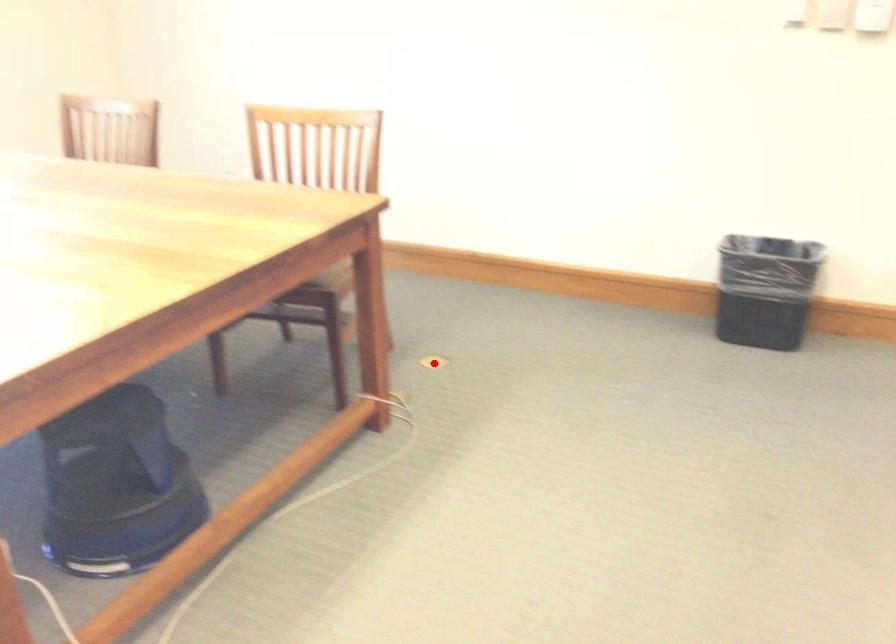
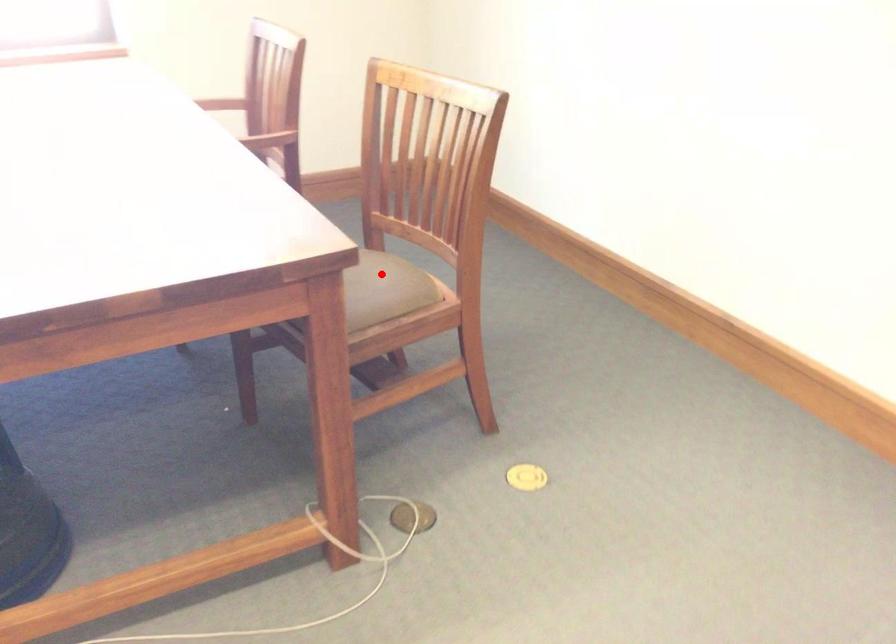
I am providing you with two images of the same scene from different viewpoints. A red point is marked on the first image and another point is marked on the second image. Do the highlighted points in image1 and image2 indicate the same real-world spot?

No